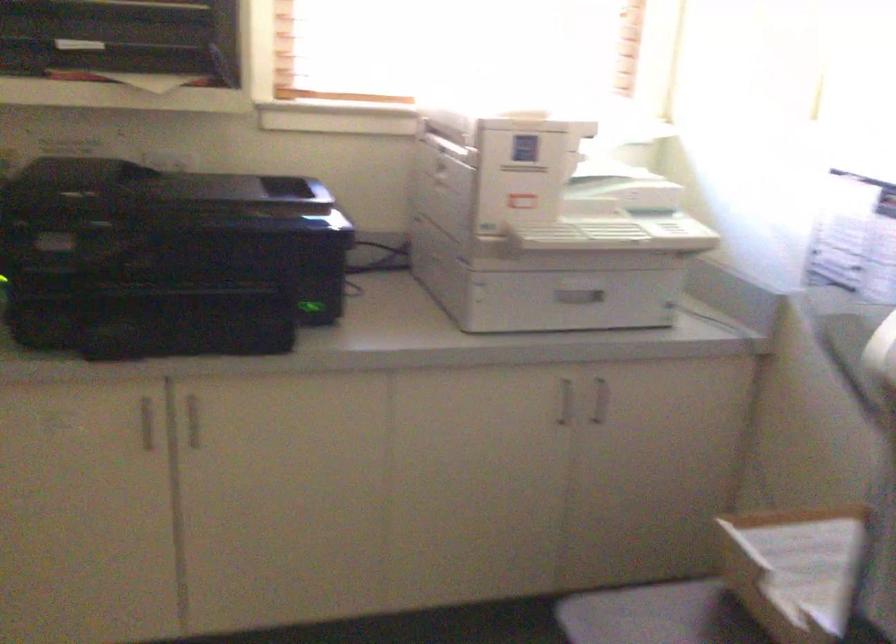
Question: Based on the continuous images, in which direction is the camera rotating? Reply with the corresponding letter.

Choices:
 (A) Left
 (B) Right
 (C) Up
 (D) Down

Answer: (A)